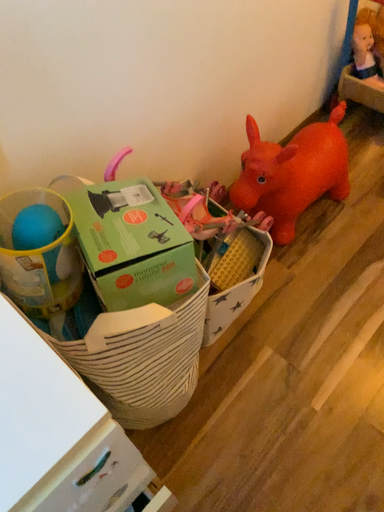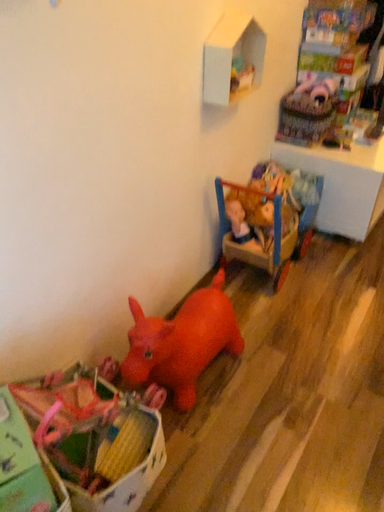
Question: How did the camera likely rotate when shooting the video?

Choices:
 (A) rotated downward
 (B) rotated upward

Answer: (B)